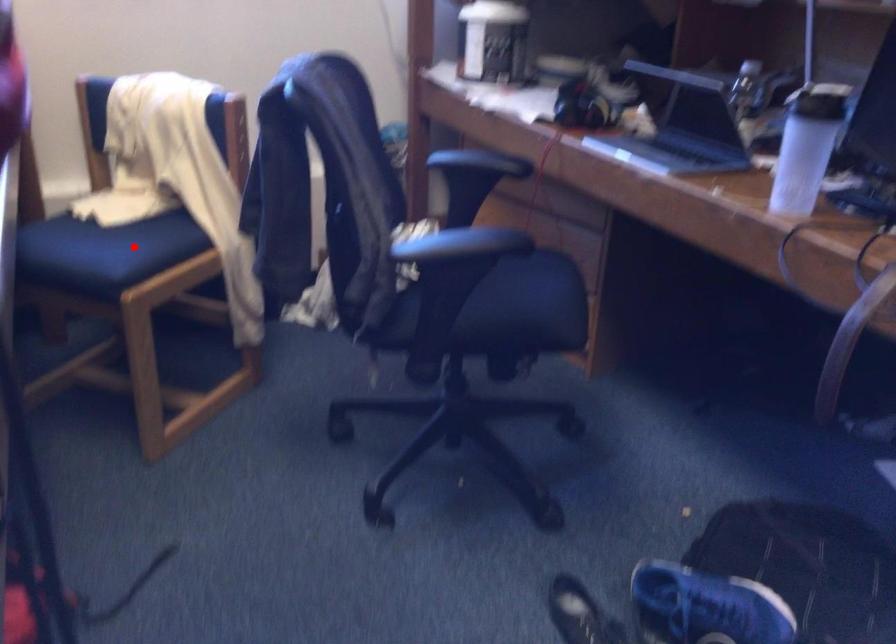
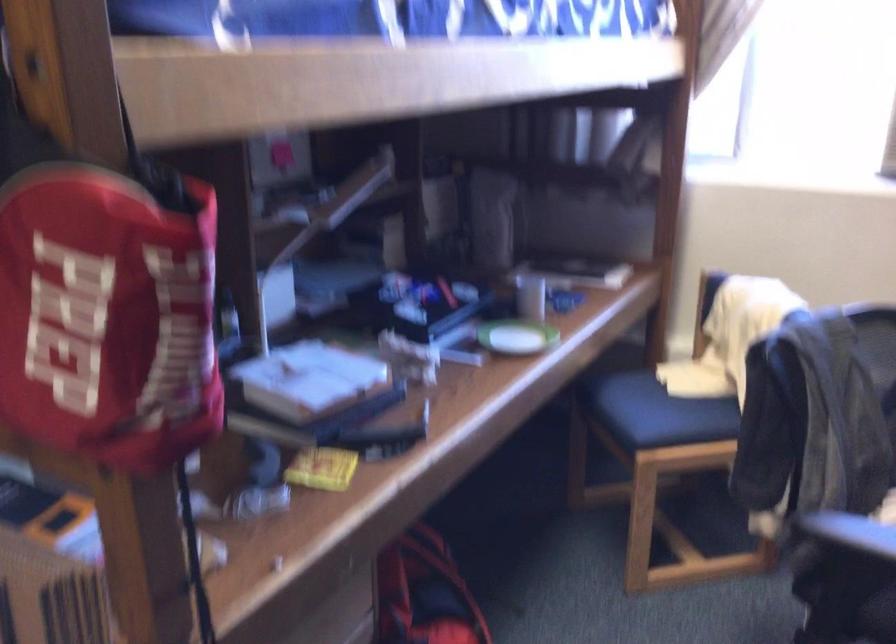
Question: I am providing you with two images of the same scene from different viewpoints. A red point is shown in image1. For the corresponding object point in image2, is it positioned nearer or farther from the camera?

Choices:
 (A) Nearer
 (B) Farther

Answer: (B)